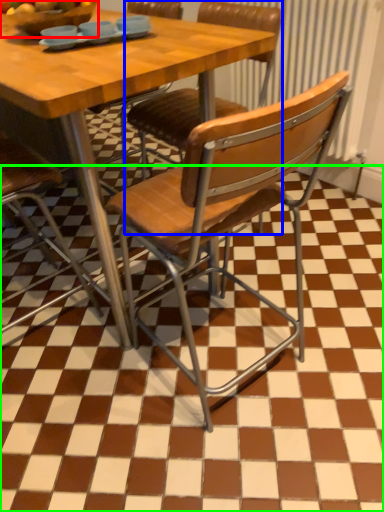
Question: Which is nearer to the fruit dish (highlighted by a red box)? chair (highlighted by a blue box) or tile (highlighted by a green box).

Choices:
 (A) chair
 (B) tile

Answer: (A)